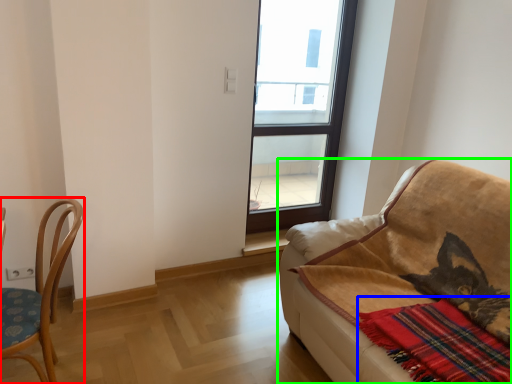
Question: Based on their relative distances, which object is farther from chair (highlighted by a red box)? Choose from plaid (highlighted by a blue box) and studio couch (highlighted by a green box).

Choices:
 (A) plaid
 (B) studio couch

Answer: (A)